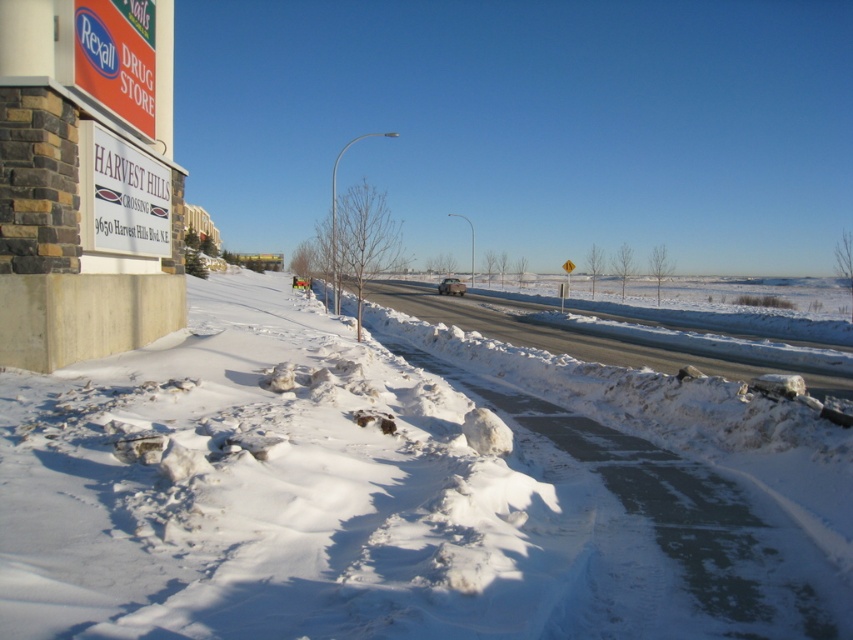
Is white powdery snow at lower left above metallic silver car at center?

No, white powdery snow at lower left is not above metallic silver car at center.

Is point (252, 305) positioned in front of point (459, 291)?

Yes, point (252, 305) is in front of point (459, 291).

Between point (202, 618) and point (456, 282), which one is positioned behind?

The point (456, 282) is more distant.

Locate an element on the screen. The width and height of the screenshot is (853, 640). white powdery snow at lower left is located at coordinates (403, 492).

Who is taller, matte red sign at upper left or metallic silver car at center?

matte red sign at upper left

Does matte red sign at upper left appear on the left side of metallic silver car at center?

Indeed, matte red sign at upper left is positioned on the left side of metallic silver car at center.

This screenshot has width=853, height=640. I want to click on matte red sign at upper left, so click(117, 56).

Is white asphalt highway at center taller than white plastic sign at upper left?

Yes.

Looking at this image, who is more distant from viewer, (x=660, y=356) or (x=149, y=240)?

The point (x=660, y=356) is behind.

The image size is (853, 640). Identify the location of white asphalt highway at center. (577, 339).